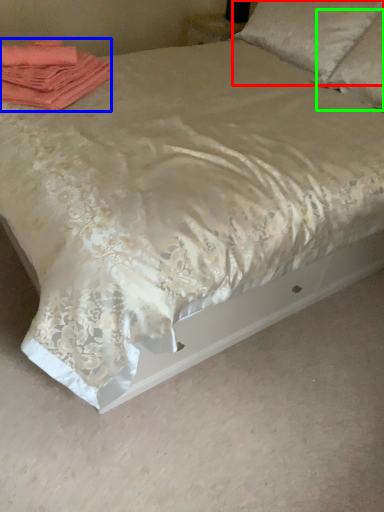
Question: Based on their relative distances, which object is farther from pillow (highlighted by a red box)? Choose from material (highlighted by a blue box) and pillow (highlighted by a green box).

Choices:
 (A) material
 (B) pillow

Answer: (A)